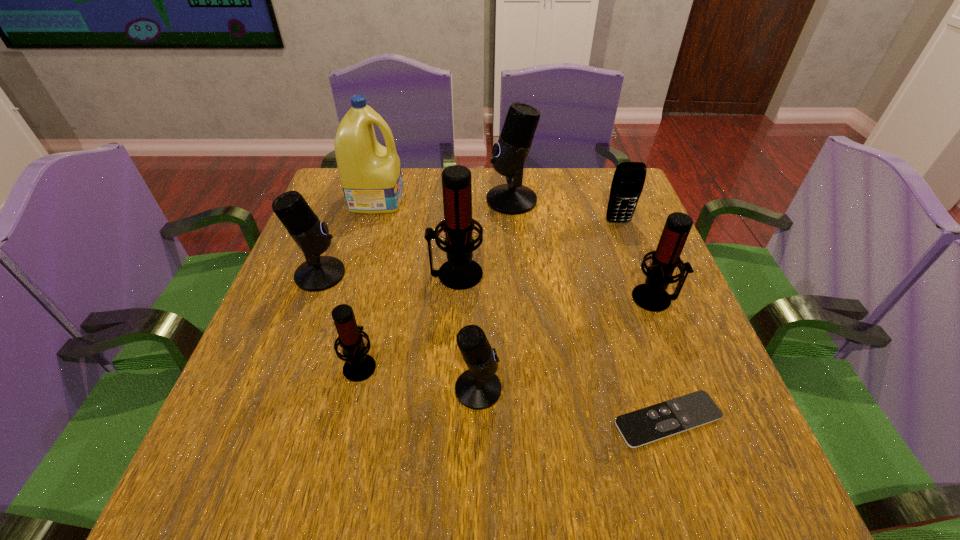
Locate an element on the screen. The width and height of the screenshot is (960, 540). detergent is located at coordinates (370, 174).

The image size is (960, 540). What are the coordinates of `the farthest black microphone` in the screenshot? It's located at (510, 153).

Locate an element on the screen. The height and width of the screenshot is (540, 960). the biggest black microphone is located at coordinates (510, 153).

At what (x,y) coordinates should I click in order to perform the action: click on the second red microphone from right to left. Please return your answer as a coordinate pair (x, y). This screenshot has width=960, height=540. Looking at the image, I should click on (460, 272).

The image size is (960, 540). I want to click on the second biggest black microphone, so click(318, 273).

Where is `the leftmost microphone`? the leftmost microphone is located at coordinates (318, 273).

Identify the location of the second biggest red microphone. The height and width of the screenshot is (540, 960). (651, 296).

Find the location of a particular element. This screenshot has height=540, width=960. the rightmost microphone is located at coordinates (651, 296).

Identify the location of cellular telephone. (628, 181).

Locate an element on the screen. the leftmost red microphone is located at coordinates (359, 366).